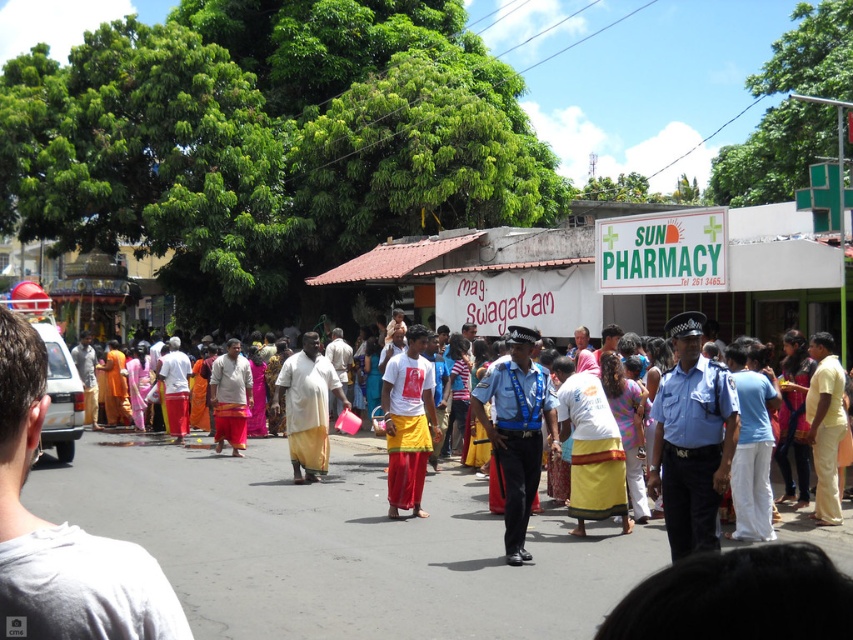
Question: Observing the image, what is the correct spatial positioning of yellow cotton dress at center in reference to blue uniform at center?

Choices:
 (A) above
 (B) below

Answer: (B)

Question: Which point appears farthest from the camera in this image?

Choices:
 (A) (390, 397)
 (B) (229, 518)

Answer: (A)

Question: Does blue uniform at center have a smaller size compared to white matte t-shirt at center?

Choices:
 (A) no
 (B) yes

Answer: (B)

Question: Does blue uniform at center appear on the left side of white matte t-shirt at center?

Choices:
 (A) yes
 (B) no

Answer: (B)

Question: Which point is farther to the camera?

Choices:
 (A) (392, 461)
 (B) (705, 419)
 (C) (453, 524)

Answer: (A)

Question: Which object appears farthest from the camera in this image?

Choices:
 (A) blue uniform at center
 (B) yellow cotton dress at center
 (C) white matte t-shirt at center

Answer: (C)